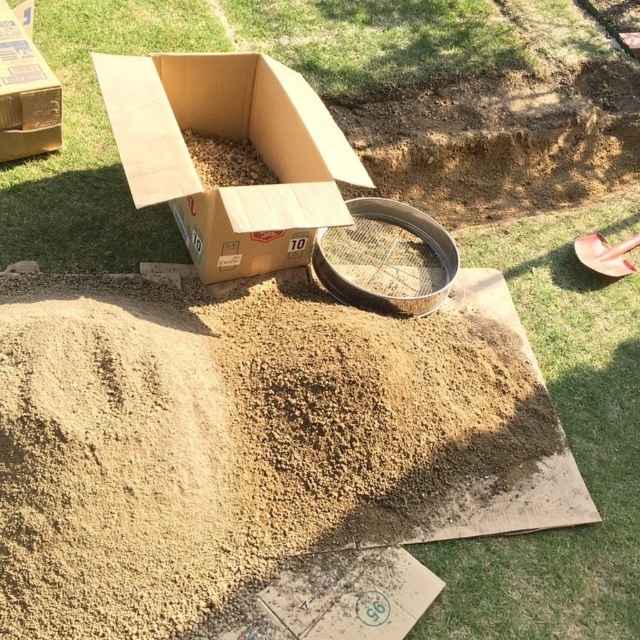
You are organizing materials in an outdoor workspace. You have a cardboard box at center and a brown cardboard box at upper left. According to their positions, which box is closer to the right edge of the workspace?

The cardboard box at center is positioned on the right side of brown cardboard box at upper left, so the cardboard box at center is closer to the right edge of the workspace.

You are a construction worker who needs to move the cardboard box at center and the brown cardboard box at upper left. Based on their positions, which box should you move first to access the spilled material easily?

The cardboard box at center is located below the brown cardboard box at upper left, so you should move the brown cardboard box at upper left first to access the spilled material easily.